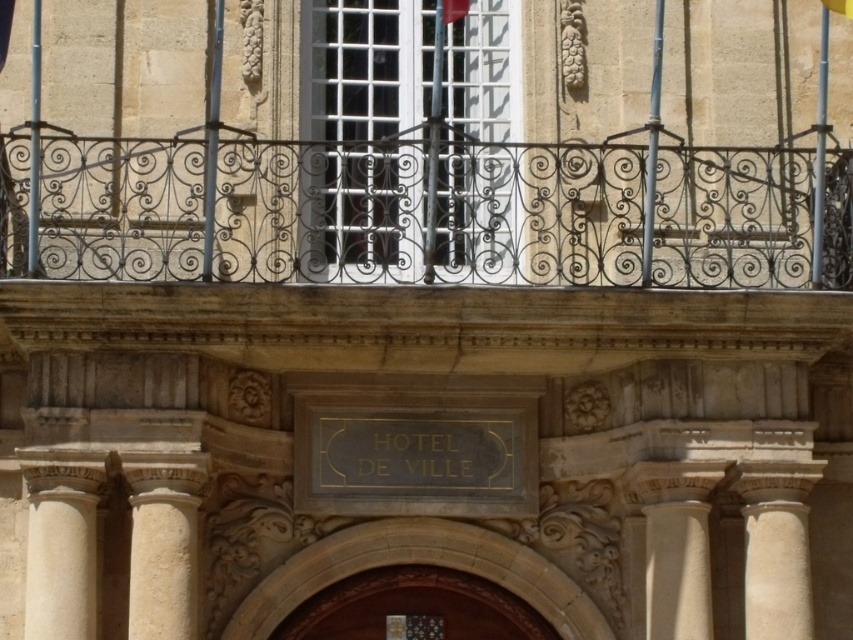
Is polished wrought iron balcony at upper center closer to the viewer compared to white marble column at lower left?

No, polished wrought iron balcony at upper center is behind white marble column at lower left.

Can you confirm if polished wrought iron balcony at upper center is taller than white marble column at lower left?

Yes, polished wrought iron balcony at upper center is taller than white marble column at lower left.

Who is more forward, (807,250) or (80,529)?

Point (80,529) is in front.

Locate an element on the screen. The height and width of the screenshot is (640, 853). polished wrought iron balcony at upper center is located at coordinates (433, 232).

Who is shorter, polished wrought iron balcony at upper center or white stone column at center?

white stone column at center is shorter.

Is polished wrought iron balcony at upper center smaller than white stone column at center?

No.

Is point (245, 268) farther from camera compared to point (660, 628)?

Yes, it is behind point (660, 628).

This screenshot has width=853, height=640. Find the location of `polished wrought iron balcony at upper center`. polished wrought iron balcony at upper center is located at coordinates (433, 232).

From the picture: Between wooden door at center and white marble column at lower left, which one has less height?

With less height is wooden door at center.

Is wooden door at center further to the viewer compared to white marble column at lower left?

Yes, it is.

The width and height of the screenshot is (853, 640). What do you see at coordinates (415, 609) in the screenshot? I see `wooden door at center` at bounding box center [415, 609].

I want to click on wooden door at center, so pyautogui.click(x=415, y=609).